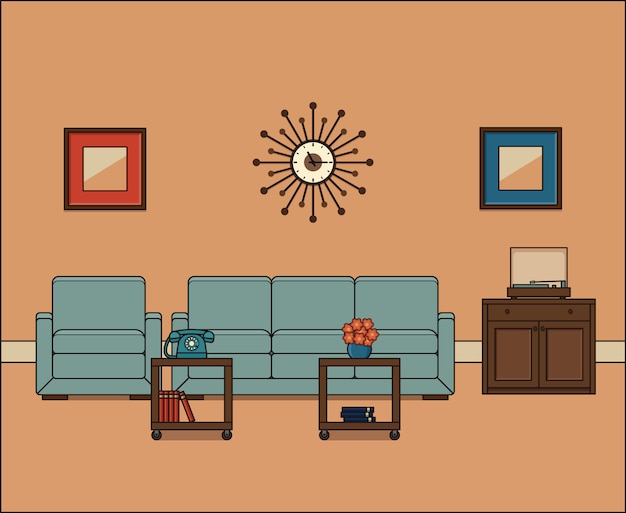
Locate an element on the screen. The image size is (626, 513). recliner chair is located at coordinates (116, 349).